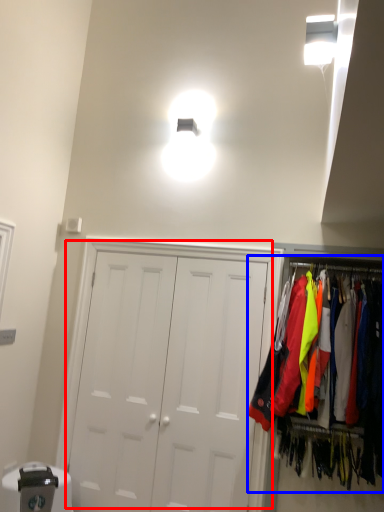
Question: Which of the following is the farthest to the observer, door (highlighted by a red box) or closet (highlighted by a blue box)?

Choices:
 (A) door
 (B) closet

Answer: (A)